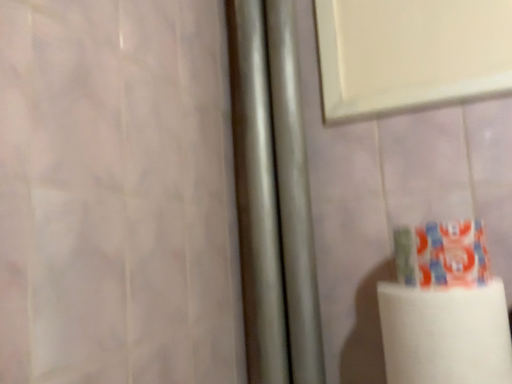
This screenshot has width=512, height=384. What do you see at coordinates (445, 334) in the screenshot?
I see `white matte paper towel at lower right` at bounding box center [445, 334].

Image resolution: width=512 pixels, height=384 pixels. Identify the location of white matte paper towel at lower right. (445, 334).

Find the location of `multicolored plastic toothpaste at lower right`. multicolored plastic toothpaste at lower right is located at coordinates (442, 254).

Describe the element at coordinates (442, 254) in the screenshot. I see `multicolored plastic toothpaste at lower right` at that location.

Find the location of a particular element. The height and width of the screenshot is (384, 512). white matte paper towel at lower right is located at coordinates (445, 334).

Is multicolored plastic toothpaste at lower right to the left of white matte paper towel at lower right from the viewer's perspective?

In fact, multicolored plastic toothpaste at lower right is to the right of white matte paper towel at lower right.

Between multicolored plastic toothpaste at lower right and white matte paper towel at lower right, which one is positioned behind?

multicolored plastic toothpaste at lower right.

Is point (414, 271) farther from camera compared to point (389, 370)?

No.

From the image's perspective, which is above, multicolored plastic toothpaste at lower right or white matte paper towel at lower right?

multicolored plastic toothpaste at lower right, from the image's perspective.

From a real-world perspective, is multicolored plastic toothpaste at lower right below white matte paper towel at lower right?

No, from a real-world perspective, multicolored plastic toothpaste at lower right is not beneath white matte paper towel at lower right.

Which object is wider, multicolored plastic toothpaste at lower right or white matte paper towel at lower right?

white matte paper towel at lower right.

Looking at this image, which of these two, multicolored plastic toothpaste at lower right or white matte paper towel at lower right, stands shorter?

With less height is multicolored plastic toothpaste at lower right.

Which of these two, multicolored plastic toothpaste at lower right or white matte paper towel at lower right, is smaller?

With smaller size is multicolored plastic toothpaste at lower right.

Is multicolored plastic toothpaste at lower right located outside white matte paper towel at lower right?

multicolored plastic toothpaste at lower right is positioned outside white matte paper towel at lower right.

Are multicolored plastic toothpaste at lower right and white matte paper towel at lower right making contact?

Absolutely, multicolored plastic toothpaste at lower right is next to and touching white matte paper towel at lower right.

Is multicolored plastic toothpaste at lower right turned away from white matte paper towel at lower right?

No, white matte paper towel at lower right is not at the back of multicolored plastic toothpaste at lower right.

How many degrees apart are the facing directions of multicolored plastic toothpaste at lower right and white matte paper towel at lower right?

The angle between the facing direction of multicolored plastic toothpaste at lower right and the facing direction of white matte paper towel at lower right is 0.00108 degrees.

Locate an element on the screen. The image size is (512, 384). paper towel on the left of multicolored plastic toothpaste at lower right is located at coordinates (445, 334).

Does white matte paper towel at lower right appear on the left side of multicolored plastic toothpaste at lower right?

Indeed, white matte paper towel at lower right is positioned on the left side of multicolored plastic toothpaste at lower right.

Which object is more forward, white matte paper towel at lower right or multicolored plastic toothpaste at lower right?

white matte paper towel at lower right is in front.

Which is in front, point (389, 349) or point (454, 257)?

The point (454, 257) is closer.

From the image's perspective, is white matte paper towel at lower right on multicolored plastic toothpaste at lower right?

Actually, white matte paper towel at lower right appears below multicolored plastic toothpaste at lower right in the image.

From a real-world perspective, is white matte paper towel at lower right on top of multicolored plastic toothpaste at lower right?

No, from a real-world perspective, white matte paper towel at lower right is not over multicolored plastic toothpaste at lower right

Can you confirm if white matte paper towel at lower right is thinner than multicolored plastic toothpaste at lower right?

No.

From the picture: Does white matte paper towel at lower right have a greater height compared to multicolored plastic toothpaste at lower right?

Correct, white matte paper towel at lower right is much taller as multicolored plastic toothpaste at lower right.

Is white matte paper towel at lower right smaller than multicolored plastic toothpaste at lower right?

Incorrect, white matte paper towel at lower right is not smaller in size than multicolored plastic toothpaste at lower right.

In the scene shown: Is white matte paper towel at lower right outside of multicolored plastic toothpaste at lower right?

Yes, white matte paper towel at lower right is outside of multicolored plastic toothpaste at lower right.

Is white matte paper towel at lower right not close to multicolored plastic toothpaste at lower right?

That's not correct — white matte paper towel at lower right is a little close to multicolored plastic toothpaste at lower right.

Based on the photo, does white matte paper towel at lower right turn towards multicolored plastic toothpaste at lower right?

No, white matte paper towel at lower right is not oriented towards multicolored plastic toothpaste at lower right.

The image size is (512, 384). I want to click on paper towel below the multicolored plastic toothpaste at lower right (from the image's perspective), so click(x=445, y=334).

You are a GUI agent. You are given a task and a screenshot of the screen. Output one action in this format:
    pyautogui.click(x=<x>, y=<y>)
    Task: Click on the paper towel in front of the multicolored plastic toothpaste at lower right
    Image resolution: width=512 pixels, height=384 pixels.
    Given the screenshot: What is the action you would take?
    pyautogui.click(x=445, y=334)

I want to click on paper towel located on the left of multicolored plastic toothpaste at lower right, so click(445, 334).